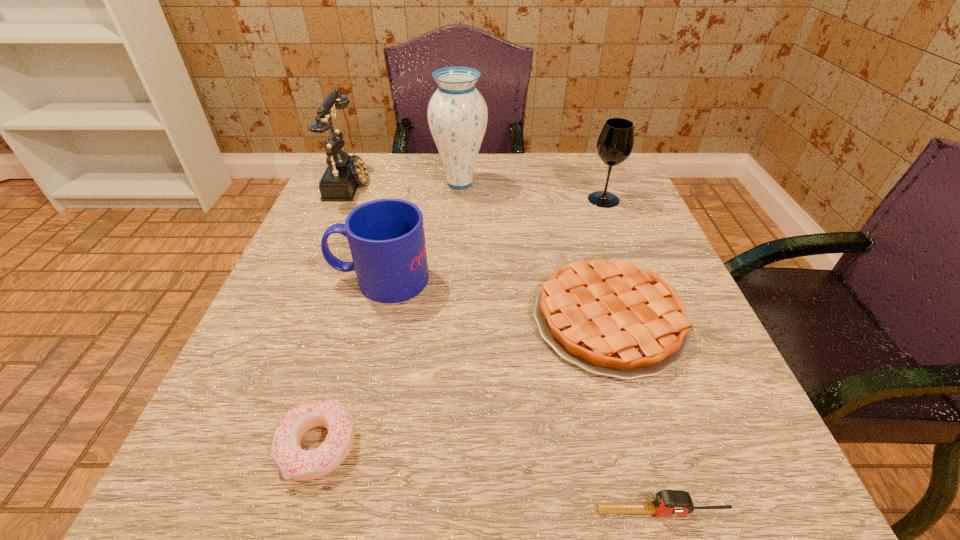
In order to click on mug located in the left edge section of the desktop in this screenshot , I will do `click(386, 237)`.

Where is `doughnut present at the left edge`? This screenshot has width=960, height=540. doughnut present at the left edge is located at coordinates (293, 462).

What are the coordinates of `wineglass at the right edge` in the screenshot? It's located at (615, 143).

Find the location of `pie that is at the right edge`. pie that is at the right edge is located at coordinates (609, 318).

Where is `tape measure at the right edge`? The height and width of the screenshot is (540, 960). tape measure at the right edge is located at coordinates (669, 503).

Where is `object at the far left corner`? object at the far left corner is located at coordinates (344, 173).

This screenshot has height=540, width=960. In order to click on object that is positioned at the near left corner in this screenshot , I will do `click(293, 462)`.

Find the location of a particular element. Image resolution: width=960 pixels, height=540 pixels. object that is at the far right corner is located at coordinates (615, 143).

You are a GUI agent. You are given a task and a screenshot of the screen. Output one action in this format:
    pyautogui.click(x=<x>, y=<y>)
    Task: Click on the object that is positioned at the near right corner
    This screenshot has width=960, height=540.
    Given the screenshot: What is the action you would take?
    pyautogui.click(x=669, y=503)

In the image, there is a desktop. Where is `vacant space at the far edge`? The height and width of the screenshot is (540, 960). vacant space at the far edge is located at coordinates (550, 199).